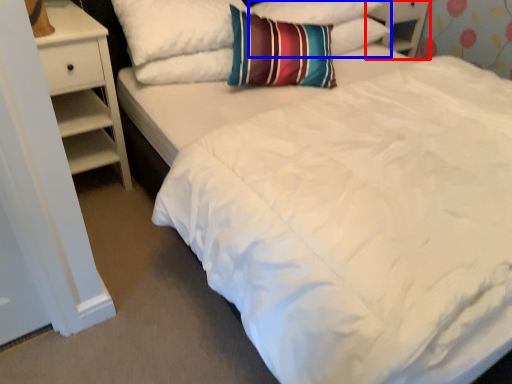
Question: Which of the following is the farthest to the observer, dresser (highlighted by a red box) or pillow (highlighted by a blue box)?

Choices:
 (A) dresser
 (B) pillow

Answer: (A)